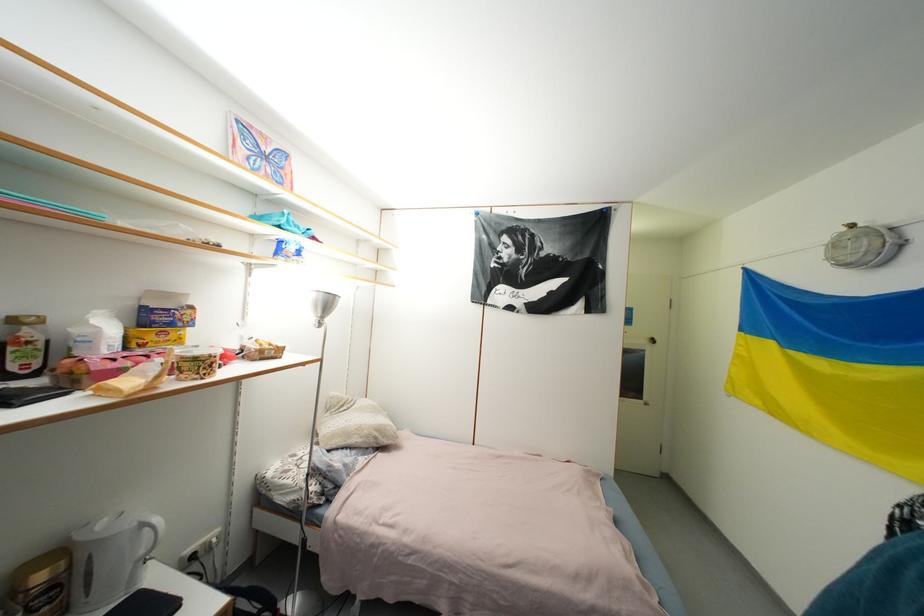
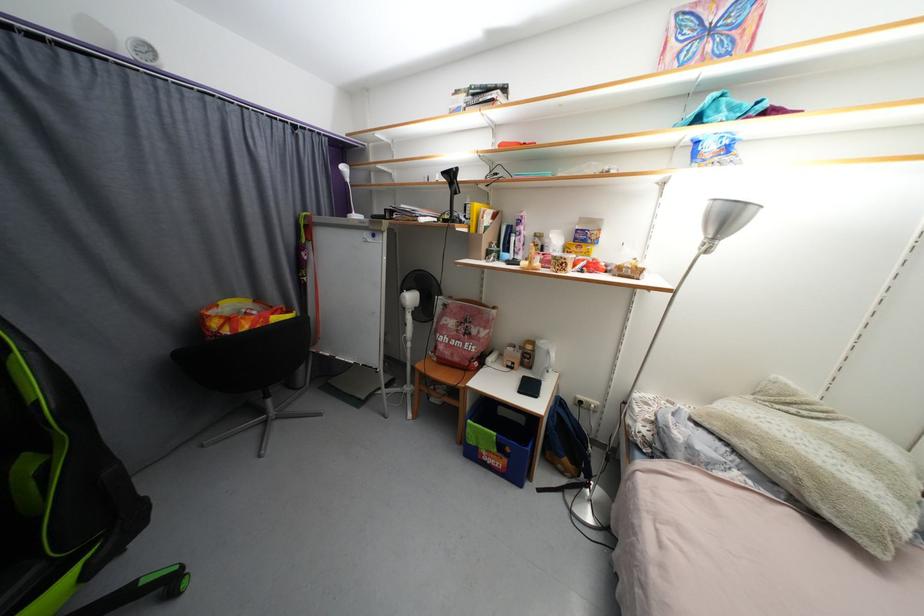
Question: I am providing you with two images of the same scene from different viewpoints. Which of the following objects are not visible in image2?

Choices:
 (A) white desk lamp
 (B) brown coffee canister
 (C) white electric kettle
 (D) none of these

Answer: (D)